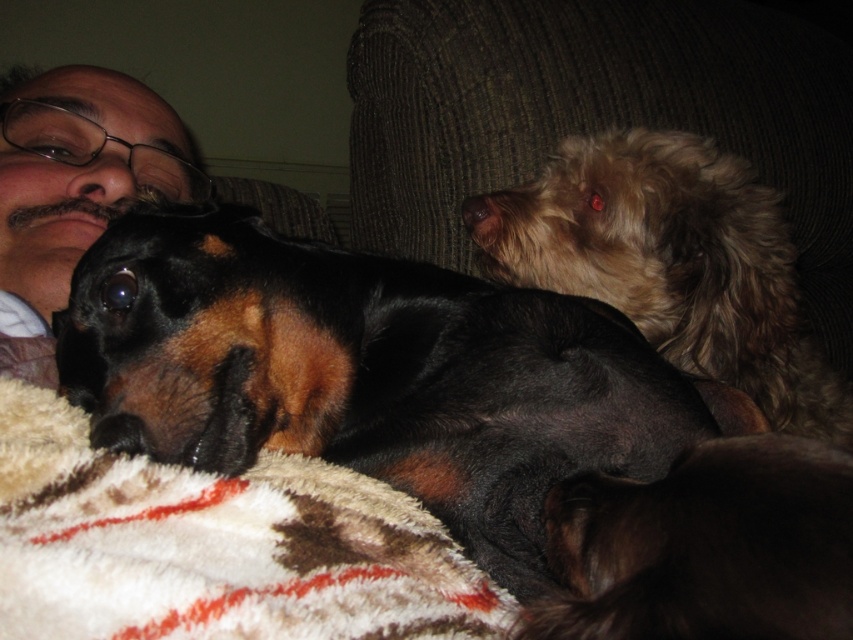
Question: Is white plush blanket at lower left thinner than black matte glasses at upper left?

Choices:
 (A) yes
 (B) no

Answer: (B)

Question: Is black fur dog at center closer to the viewer compared to black matte glasses at upper left?

Choices:
 (A) no
 (B) yes

Answer: (B)

Question: Among these points, which one is nearest to the camera?

Choices:
 (A) (821, 413)
 (B) (259, 294)

Answer: (B)

Question: Which object is positioned closest to the fuzzy brown dog at upper right?

Choices:
 (A) white plush blanket at lower left
 (B) black matte glasses at upper left

Answer: (B)

Question: Is black fur dog at center positioned in front of fuzzy brown dog at upper right?

Choices:
 (A) no
 (B) yes

Answer: (B)

Question: Which is nearer to the white plush blanket at lower left?

Choices:
 (A) black fur dog at center
 (B) black matte glasses at upper left

Answer: (A)